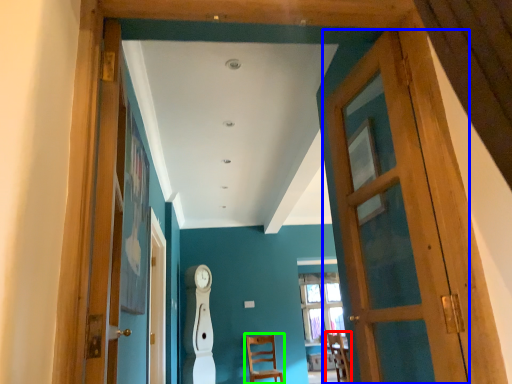
Question: Considering the real-world distances, which object is farthest from chair (highlighted by a red box)? door (highlighted by a blue box) or chair (highlighted by a green box)?

Choices:
 (A) door
 (B) chair

Answer: (A)